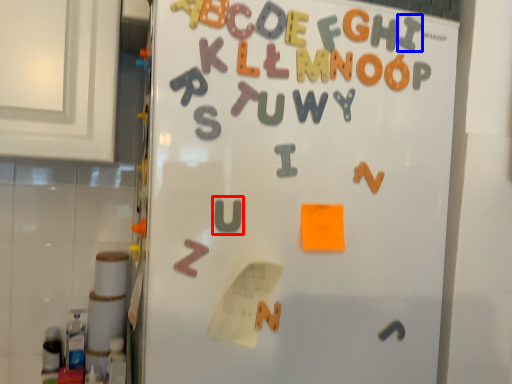
Question: Among these objects, which one is nearest to the camera, letter (highlighted by a red box) or letter (highlighted by a blue box)?

Choices:
 (A) letter
 (B) letter

Answer: (A)